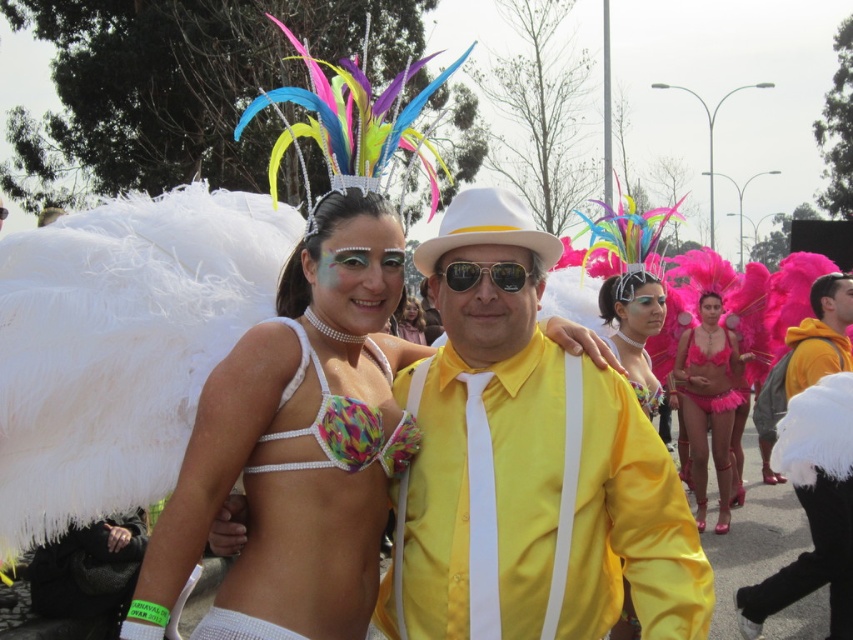
Question: Can you confirm if orange fleece hoodie at right is smaller than sunglasses at center?

Choices:
 (A) yes
 (B) no

Answer: (B)

Question: Does fuzzy pink bikini at center appear on the right side of matte pink feathers at center?

Choices:
 (A) no
 (B) yes

Answer: (B)

Question: Which object appears closest to the camera in this image?

Choices:
 (A) yellow satin suit at center
 (B) multicolored beaded bikini top at center
 (C) fuzzy pink bikini at center
 (D) orange fleece hoodie at right

Answer: (B)

Question: Which point is closer to the camera taking this photo?

Choices:
 (A) pyautogui.click(x=816, y=328)
 (B) pyautogui.click(x=267, y=472)
 (C) pyautogui.click(x=358, y=460)
 (D) pyautogui.click(x=412, y=323)

Answer: (B)

Question: Which point is farther from the camera taking this photo?

Choices:
 (A) (375, 612)
 (B) (840, 276)
 (C) (730, 371)

Answer: (C)

Question: In this image, where is yellow satin shirt at center located relative to multicolored beaded bikini top at center?

Choices:
 (A) above
 (B) below

Answer: (B)